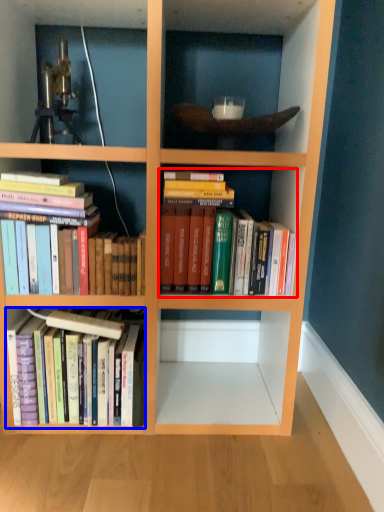
Question: Which object appears closest to the camera in this image, book (highlighted by a red box) or book (highlighted by a blue box)?

Choices:
 (A) book
 (B) book

Answer: (A)